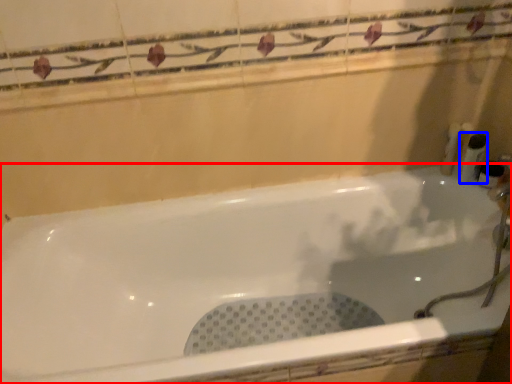
Question: Which object is further to the camera taking this photo, bathtub (highlighted by a red box) or toiletry (highlighted by a blue box)?

Choices:
 (A) bathtub
 (B) toiletry

Answer: (B)